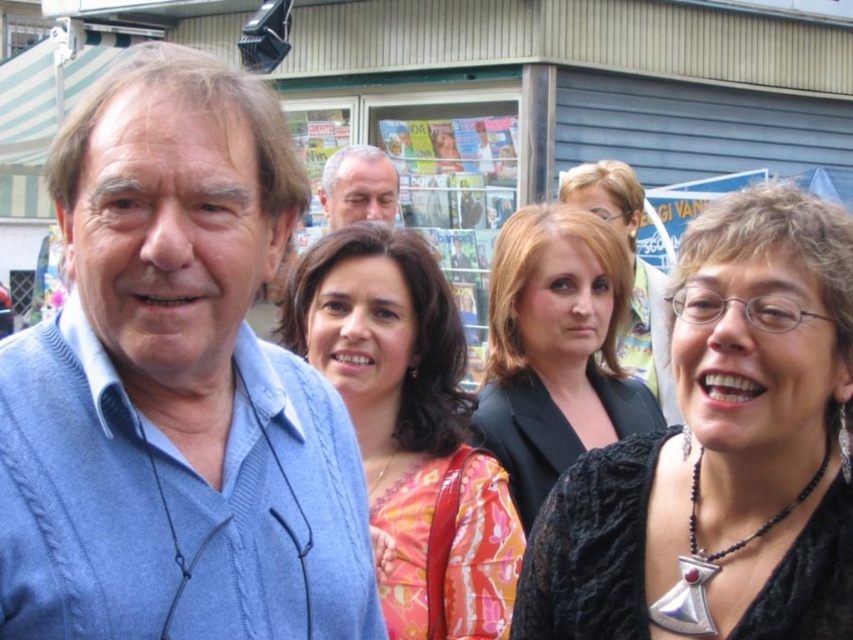
Is black fabric jacket at center below smooth gray hair at center?

Indeed, black fabric jacket at center is positioned under smooth gray hair at center.

Is point (663, 388) in front of point (345, 188)?

Yes, it is.

Locate an element on the screen. The height and width of the screenshot is (640, 853). black fabric jacket at center is located at coordinates (631, 272).

Between blue sweater at left and black fabric jacket at center, which one appears on the left side from the viewer's perspective?

blue sweater at left

Is blue sweater at left thinner than black fabric jacket at center?

In fact, blue sweater at left might be wider than black fabric jacket at center.

Locate an element on the screen. blue sweater at left is located at coordinates (175, 387).

This screenshot has width=853, height=640. In order to click on blue sweater at left in this screenshot , I will do `click(175, 387)`.

In the scene shown: Does orange floral dress at center appear on the left side of smooth gray hair at center?

No, orange floral dress at center is not to the left of smooth gray hair at center.

Which is behind, point (305, 282) or point (352, 221)?

Positioned behind is point (352, 221).

Locate an element on the screen. The width and height of the screenshot is (853, 640). orange floral dress at center is located at coordinates (407, 419).